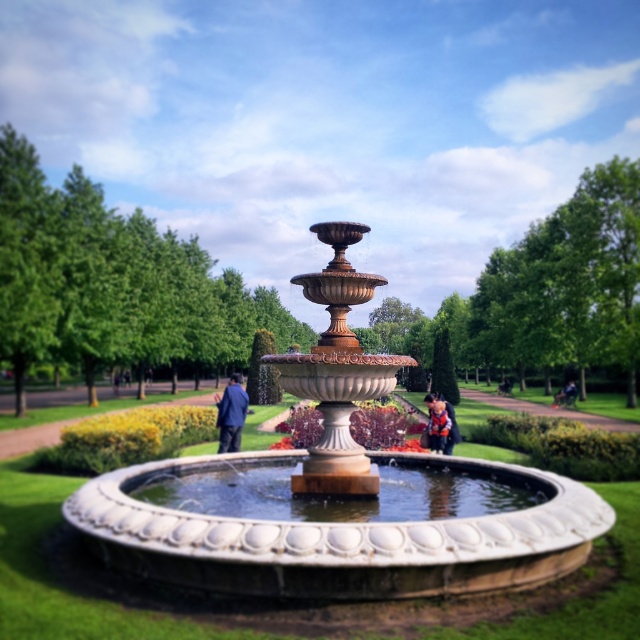
Who is positioned more to the right, white stone fountain at center or orange life vest at center?

orange life vest at center is more to the right.

Is white stone fountain at center smaller than orange life vest at center?

Yes, white stone fountain at center is smaller than orange life vest at center.

Which is behind, point (528, 483) or point (435, 410)?

The point (435, 410) is more distant.

Where is `white stone fountain at center`? The width and height of the screenshot is (640, 640). white stone fountain at center is located at coordinates (337, 496).

This screenshot has height=640, width=640. What do you see at coordinates (337, 496) in the screenshot?
I see `white stone fountain at center` at bounding box center [337, 496].

Locate an element on the screen. Image resolution: width=640 pixels, height=640 pixels. white stone fountain at center is located at coordinates (337, 496).

Is blue fabric jacket at center closer to the viewer compared to orange life vest at center?

That is False.

Can you confirm if blue fabric jacket at center is positioned to the right of orange life vest at center?

No, blue fabric jacket at center is not to the right of orange life vest at center.

Does point (230, 413) lie behind point (424, 403)?

No, (230, 413) is in front of (424, 403).

Find the location of a particular element. This screenshot has height=640, width=640. blue fabric jacket at center is located at coordinates (230, 413).